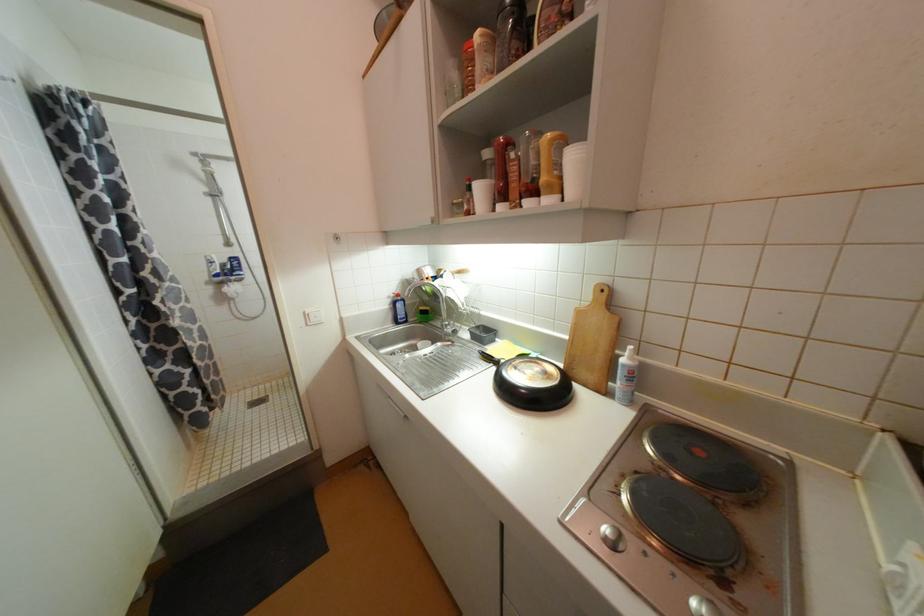
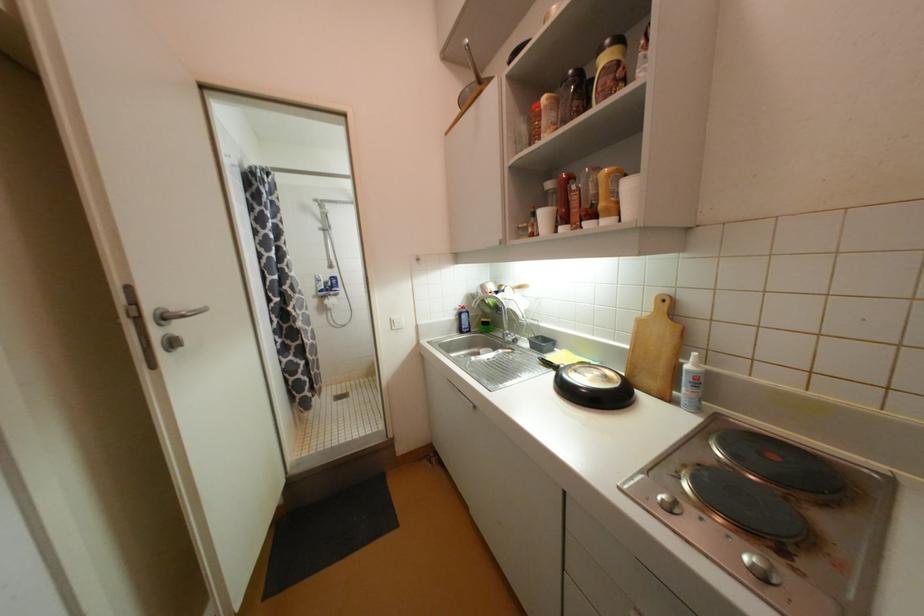
Locate, in the second image, the point that corresponds to (451,326) in the first image.

(513, 336)